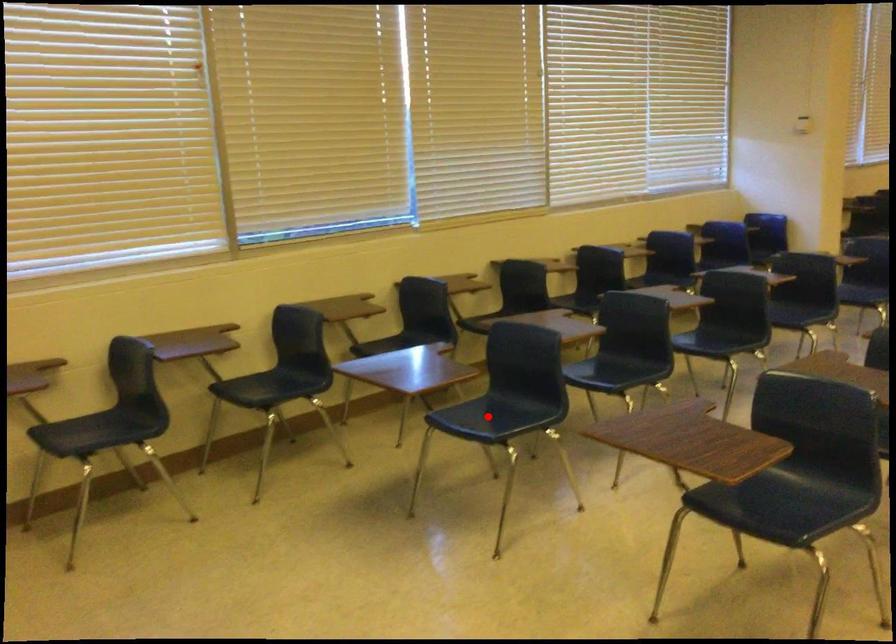
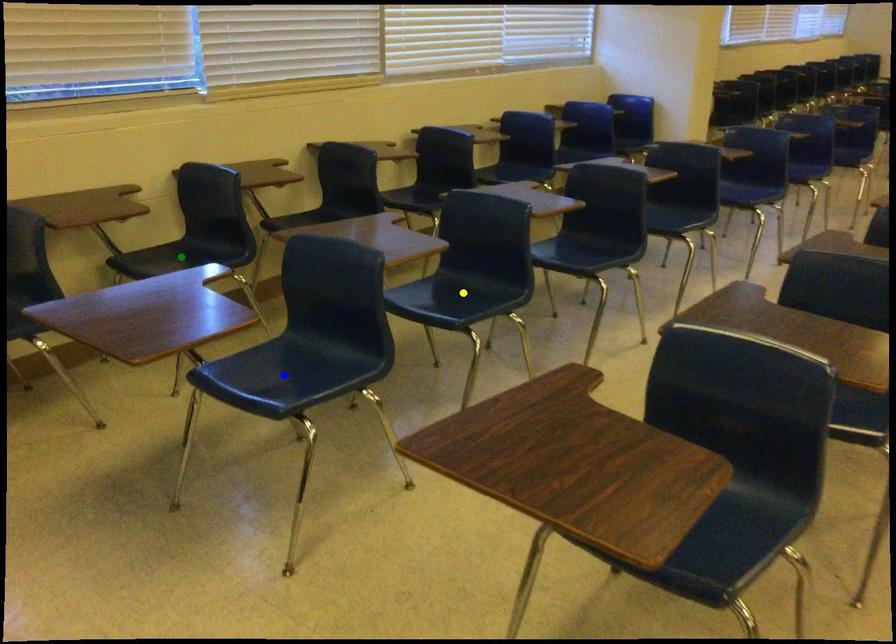
Question: I am providing you with two images of the same scene from different viewpoints. A red point is marked on the first image. You are given multiple points on the second image. Can you choose the point in image 2 that corresponds to the point in image 1?

Choices:
 (A) yellow point
 (B) blue point
 (C) green point

Answer: (B)